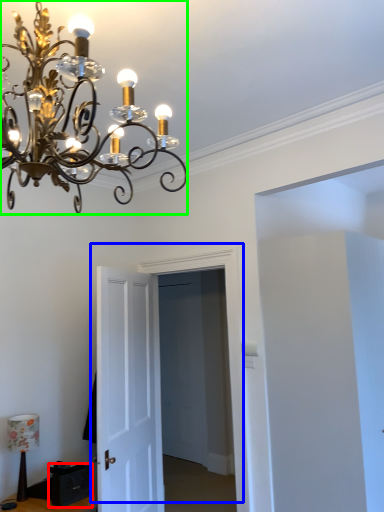
Question: Which object is the farthest from drawer (highlighted by a red box)? Choose among these: door (highlighted by a blue box) or lamp (highlighted by a green box).

Choices:
 (A) door
 (B) lamp

Answer: (B)